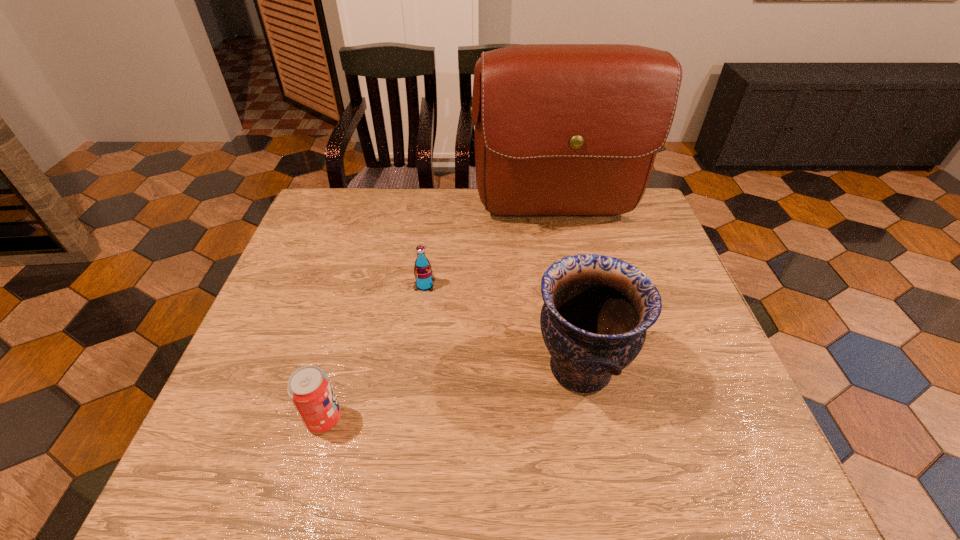
In the image, there is a desktop. At what (x,y) coordinates should I click in order to perform the action: click on free space at the far left corner. Please return your answer as a coordinate pair (x, y). The height and width of the screenshot is (540, 960). Looking at the image, I should click on (359, 217).

Where is `free space between the pottery and the third nearest object`? Image resolution: width=960 pixels, height=540 pixels. free space between the pottery and the third nearest object is located at coordinates (503, 327).

Locate an element on the screen. The height and width of the screenshot is (540, 960). empty location between the tallest object and the nearer soda is located at coordinates (441, 317).

Locate an element on the screen. This screenshot has width=960, height=540. vacant area that lies between the pottery and the nearer soda is located at coordinates (452, 394).

Find the location of `free space between the leftmost object and the satchel`. free space between the leftmost object and the satchel is located at coordinates (441, 317).

Where is `free space between the third shortest object and the leftmost object`? The width and height of the screenshot is (960, 540). free space between the third shortest object and the leftmost object is located at coordinates (452, 394).

Where is `free spot between the third shortest object and the leftmost object`? Image resolution: width=960 pixels, height=540 pixels. free spot between the third shortest object and the leftmost object is located at coordinates (452, 394).

The image size is (960, 540). Identify the location of blank region between the satchel and the leftmost object. (441, 317).

You are a GUI agent. You are given a task and a screenshot of the screen. Output one action in this format:
    pyautogui.click(x=<x>, y=<y>)
    Task: Click on the empty location between the left soda and the farther soda
    This screenshot has height=540, width=960.
    Given the screenshot: What is the action you would take?
    pyautogui.click(x=374, y=352)

Find the location of `vacant space that's between the third nearest object and the farthest object`. vacant space that's between the third nearest object and the farthest object is located at coordinates (491, 251).